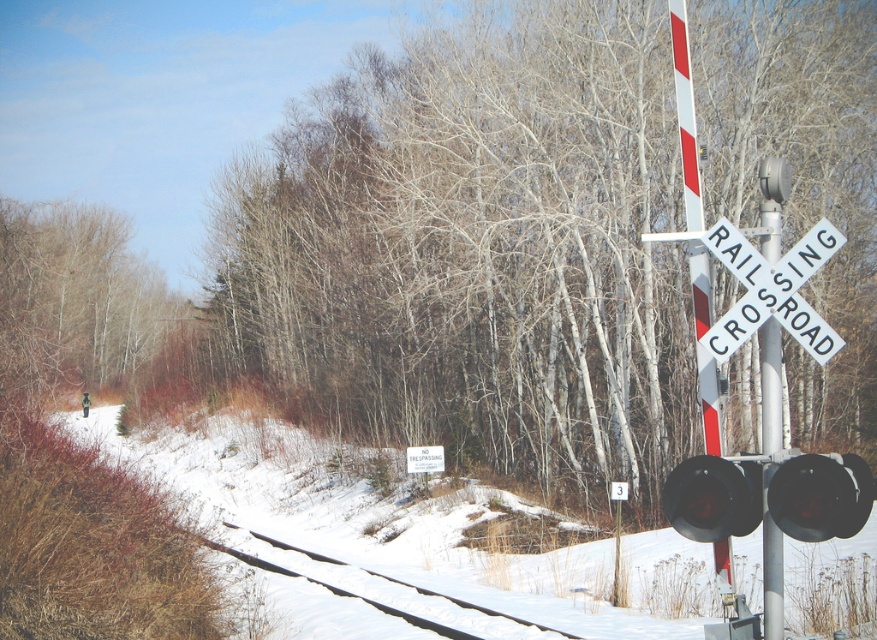
Question: Is black metal train track at lower left positioned before white wooden sign at center?

Choices:
 (A) no
 (B) yes

Answer: (B)

Question: Among these points, which one is farthest from the camera?

Choices:
 (A) (371, 579)
 (B) (54, 227)
 (C) (745, 518)
 (D) (778, 509)

Answer: (B)

Question: Can you confirm if smooth white tree at center is positioned to the right of white wooden sign at center?

Choices:
 (A) yes
 (B) no

Answer: (A)

Question: Which object is positioned farthest from the black glass traffic light at right?

Choices:
 (A) black matte traffic light at center right
 (B) smooth white tree at center
 (C) brown wood tree at upper left

Answer: (C)

Question: Is brown wood tree at upper left below black glass traffic light at right?

Choices:
 (A) yes
 (B) no

Answer: (B)

Question: Among these objects, which one is farthest from the camera?

Choices:
 (A) black metal train track at lower left
 (B) white powdery snow at lower left
 (C) black glass traffic light at right

Answer: (A)